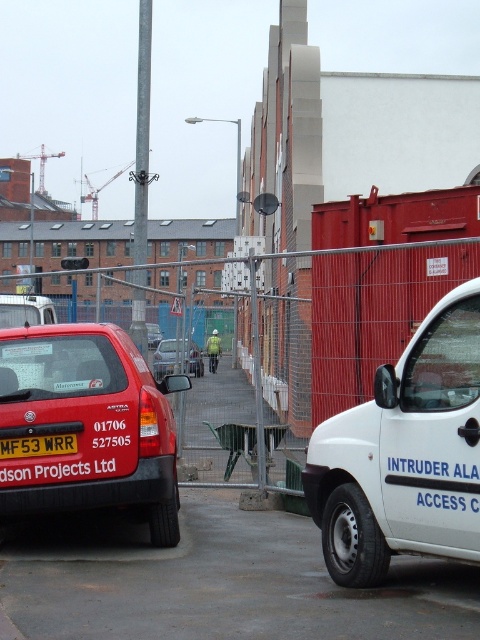
From the picture: You are a delivery driver who needs to locate the metal mesh fence at center in an urban industrial area. According to the scene description, where should you look to find it?

The metal mesh fence at center is located at the 2D coordinates point [85,419].